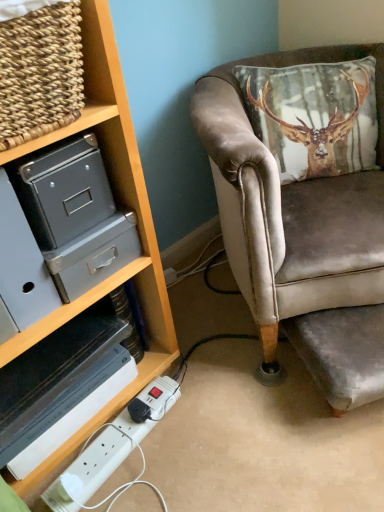
Question: From the image's perspective, is white plastic extension cord at lower left located above woven wood basket at upper left?

Choices:
 (A) yes
 (B) no

Answer: (B)

Question: From a real-world perspective, is white plastic extension cord at lower left over woven wood basket at upper left?

Choices:
 (A) no
 (B) yes

Answer: (A)

Question: Is white plastic extension cord at lower left oriented away from woven wood basket at upper left?

Choices:
 (A) yes
 (B) no

Answer: (B)

Question: Is the surface of white plastic extension cord at lower left in direct contact with woven wood basket at upper left?

Choices:
 (A) yes
 (B) no

Answer: (B)

Question: Does white plastic extension cord at lower left appear on the right side of woven wood basket at upper left?

Choices:
 (A) no
 (B) yes

Answer: (B)

Question: Is white plastic extension cord at lower left taller or shorter than woven wood basket at upper left?

Choices:
 (A) short
 (B) tall

Answer: (A)

Question: In terms of size, does white plastic extension cord at lower left appear bigger or smaller than woven wood basket at upper left?

Choices:
 (A) big
 (B) small

Answer: (B)

Question: Do you think white plastic extension cord at lower left is within woven wood basket at upper left, or outside of it?

Choices:
 (A) inside
 (B) outside

Answer: (B)

Question: Considering the positions of point (82, 459) and point (89, 39), is point (82, 459) closer or farther from the camera than point (89, 39)?

Choices:
 (A) farther
 (B) closer

Answer: (A)

Question: From the image's perspective, is velvet brown chair at right above or below woven wood basket at upper left?

Choices:
 (A) above
 (B) below

Answer: (B)

Question: From a real-world perspective, is velvet brown chair at right above or below woven wood basket at upper left?

Choices:
 (A) above
 (B) below

Answer: (B)

Question: Is velvet brown chair at right bigger or smaller than woven wood basket at upper left?

Choices:
 (A) big
 (B) small

Answer: (A)

Question: In terms of height, does velvet brown chair at right look taller or shorter compared to woven wood basket at upper left?

Choices:
 (A) short
 (B) tall

Answer: (B)

Question: Is woven wood basket at upper left wider or thinner than white plastic extension cord at lower left?

Choices:
 (A) thin
 (B) wide

Answer: (B)

Question: Is woven wood basket at upper left taller or shorter than white plastic extension cord at lower left?

Choices:
 (A) short
 (B) tall

Answer: (B)